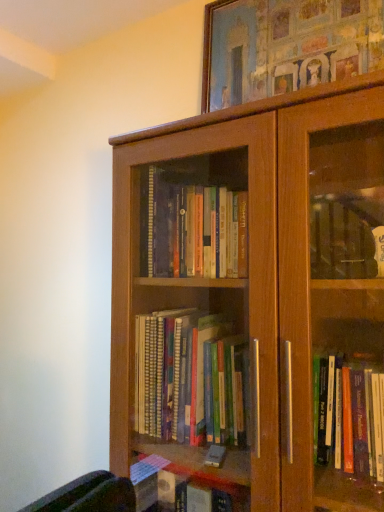
The image size is (384, 512). What do you see at coordinates (255, 301) in the screenshot? I see `brown wood bookcase at center` at bounding box center [255, 301].

Where is `brown wood bookcase at center`? This screenshot has width=384, height=512. brown wood bookcase at center is located at coordinates (255, 301).

The height and width of the screenshot is (512, 384). Describe the element at coordinates (286, 46) in the screenshot. I see `wooden picture frame at upper center` at that location.

Where is `wooden picture frame at upper center`? wooden picture frame at upper center is located at coordinates (286, 46).

At what (x,y) coordinates should I click in order to perform the action: click on brown wood bookcase at center. Please return your answer as a coordinate pair (x, y). The height and width of the screenshot is (512, 384). Looking at the image, I should click on (255, 301).

Which is more to the left, wooden picture frame at upper center or brown wood bookcase at center?

brown wood bookcase at center is more to the left.

Is wooden picture frame at upper center positioned in front of brown wood bookcase at center?

No, wooden picture frame at upper center is behind brown wood bookcase at center.

Does point (332, 9) come farther from viewer compared to point (288, 400)?

Yes, it is.

From the image's perspective, is wooden picture frame at upper center beneath brown wood bookcase at center?

No, from the image's perspective, wooden picture frame at upper center is not below brown wood bookcase at center.

From a real-world perspective, is wooden picture frame at upper center under brown wood bookcase at center?

Incorrect, from a real-world perspective, wooden picture frame at upper center is higher than brown wood bookcase at center.

Which of these two, wooden picture frame at upper center or brown wood bookcase at center, is wider?

brown wood bookcase at center is wider.

Considering the relative sizes of wooden picture frame at upper center and brown wood bookcase at center in the image provided, is wooden picture frame at upper center taller than brown wood bookcase at center?

No.

Is wooden picture frame at upper center smaller than brown wood bookcase at center?

Indeed, wooden picture frame at upper center has a smaller size compared to brown wood bookcase at center.

Would you say wooden picture frame at upper center is outside brown wood bookcase at center?

Yes, wooden picture frame at upper center is not within brown wood bookcase at center.

Is wooden picture frame at upper center touching brown wood bookcase at center?

wooden picture frame at upper center is not next to brown wood bookcase at center, and they're not touching.

Could you tell me if wooden picture frame at upper center is turned towards brown wood bookcase at center?

No, wooden picture frame at upper center is not oriented towards brown wood bookcase at center.

How many degrees apart are the facing directions of wooden picture frame at upper center and brown wood bookcase at center?

They differ by 1.38 degrees in their facing directions.

How distant is wooden picture frame at upper center from brown wood bookcase at center?

wooden picture frame at upper center is 46.37 centimeters away from brown wood bookcase at center.

Find the location of `bookcase that is below the wooden picture frame at upper center (from the image's perspective)`. bookcase that is below the wooden picture frame at upper center (from the image's perspective) is located at coordinates (255, 301).

In the scene shown: Does brown wood bookcase at center appear on the left side of wooden picture frame at upper center?

Yes.

Which is behind, brown wood bookcase at center or wooden picture frame at upper center?

wooden picture frame at upper center is further from the camera.

Which is nearer, (341,356) or (250,14)?

Point (341,356) is positioned closer to the camera compared to point (250,14).

From the image's perspective, is brown wood bookcase at center positioned above or below wooden picture frame at upper center?

brown wood bookcase at center is below wooden picture frame at upper center.

From a real-world perspective, is brown wood bookcase at center physically above wooden picture frame at upper center?

Actually, brown wood bookcase at center is physically below wooden picture frame at upper center in the real world.

In terms of width, does brown wood bookcase at center look wider or thinner when compared to wooden picture frame at upper center?

Clearly, brown wood bookcase at center has more width compared to wooden picture frame at upper center.

In terms of height, does brown wood bookcase at center look taller or shorter compared to wooden picture frame at upper center?

Considering their sizes, brown wood bookcase at center has more height than wooden picture frame at upper center.

Considering the relative sizes of brown wood bookcase at center and wooden picture frame at upper center in the image provided, is brown wood bookcase at center smaller than wooden picture frame at upper center?

No.

Is brown wood bookcase at center not within wooden picture frame at upper center?

brown wood bookcase at center lies outside wooden picture frame at upper center's area.

Is brown wood bookcase at center with wooden picture frame at upper center?

No, brown wood bookcase at center is not with wooden picture frame at upper center.

Is brown wood bookcase at center positioned with its back to wooden picture frame at upper center?

That's not correct — brown wood bookcase at center is not looking away from wooden picture frame at upper center.

How different are the orientations of brown wood bookcase at center and wooden picture frame at upper center in degrees?

The angle between the facing direction of brown wood bookcase at center and the facing direction of wooden picture frame at upper center is 1.38 degrees.

Locate an element on the screen. picture frame on the right of the brown wood bookcase at center is located at coordinates (286, 46).

Find the location of a particular element. The width and height of the screenshot is (384, 512). bookcase below the wooden picture frame at upper center (from the image's perspective) is located at coordinates (255, 301).

Locate an element on the screen. The width and height of the screenshot is (384, 512). bookcase below the wooden picture frame at upper center (from a real-world perspective) is located at coordinates (255, 301).